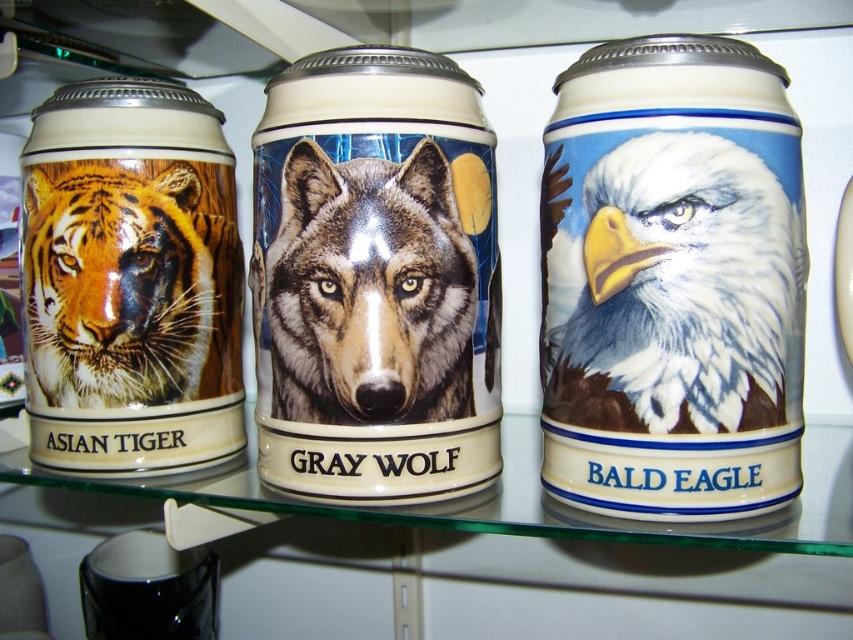
Question: Which object is farther from the camera taking this photo?

Choices:
 (A) matte ceramic tiger at left
 (B) white glossy bald eagle at center

Answer: (A)

Question: Is glossy ceramic mug at center positioned in front of white glossy bald eagle at center?

Choices:
 (A) no
 (B) yes

Answer: (A)

Question: Which of these objects is positioned closest to the matte ceramic tiger at left?

Choices:
 (A) white glossy bald eagle at center
 (B) glossy ceramic mug at center

Answer: (B)

Question: Does white glossy bald eagle at center have a smaller size compared to matte ceramic tiger at left?

Choices:
 (A) no
 (B) yes

Answer: (A)

Question: Which point is farther to the camera?

Choices:
 (A) matte ceramic tiger at left
 (B) glossy ceramic mug at center

Answer: (A)

Question: Is glossy ceramic mug at center above matte ceramic tiger at left?

Choices:
 (A) no
 (B) yes

Answer: (B)